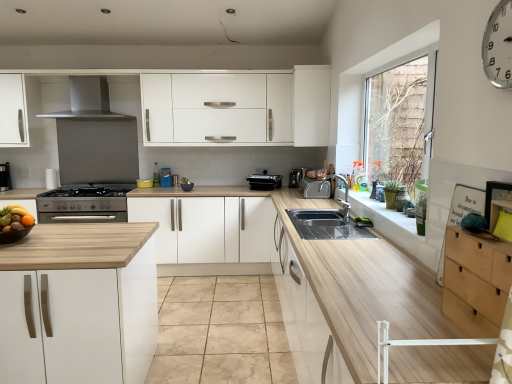
Identify the location of vacant space positioned to the left of beech wood drawer at right, marked as the third cabinetry in a back-to-front arrangement. (412, 334).